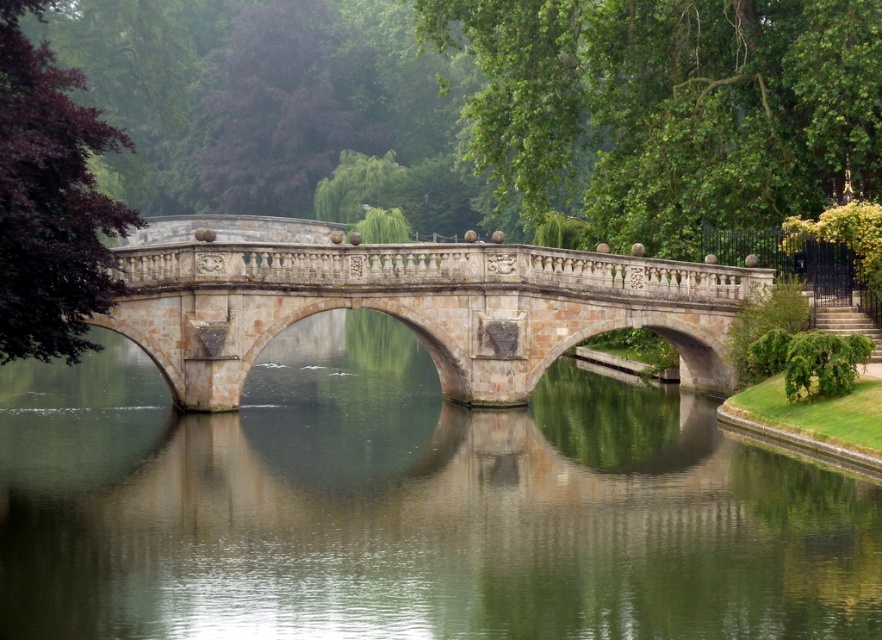
Question: Which object appears closest to the camera in this image?

Choices:
 (A) stone bridge at center
 (B) smooth stone water at center

Answer: (B)

Question: Which point is farther from the camera taking this photo?

Choices:
 (A) (584, 403)
 (B) (428, 250)

Answer: (A)

Question: Where is smooth stone water at center located in relation to stone bridge at center in the image?

Choices:
 (A) above
 (B) below

Answer: (B)

Question: Can you confirm if smooth stone water at center is positioned below stone bridge at center?

Choices:
 (A) yes
 (B) no

Answer: (A)

Question: Does smooth stone water at center appear on the left side of stone bridge at center?

Choices:
 (A) no
 (B) yes

Answer: (A)

Question: Which object is farther from the camera taking this photo?

Choices:
 (A) stone bridge at center
 (B) smooth stone water at center

Answer: (A)